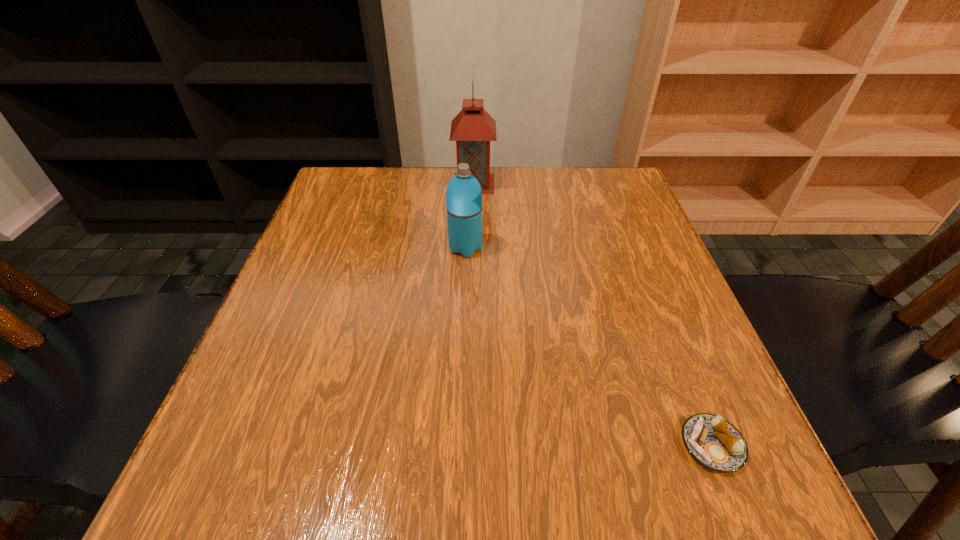
Where is `the tallest object`? the tallest object is located at coordinates (473, 128).

You are a GUI agent. You are given a task and a screenshot of the screen. Output one action in this format:
    pyautogui.click(x=<x>, y=<y>)
    Task: Click on the farthest object
    This screenshot has width=960, height=540.
    Given the screenshot: What is the action you would take?
    pyautogui.click(x=473, y=128)

Where is `the second tallest object`? This screenshot has width=960, height=540. the second tallest object is located at coordinates (463, 195).

Find the location of a particular element. the second farthest object is located at coordinates [463, 195].

The height and width of the screenshot is (540, 960). What are the coordinates of `the rightmost object` in the screenshot? It's located at (714, 442).

Find the location of `the nearest object`. the nearest object is located at coordinates (714, 442).

Find the location of a particular element. The image size is (960, 540). vacant space located 0.290m on the right of the farthest object is located at coordinates (604, 184).

Find the location of a particular element. vacant space located 0.120m on the back of the thermos bottle is located at coordinates (468, 208).

This screenshot has height=540, width=960. In order to click on vacant space located 0.270m on the left of the shortest object in this screenshot , I will do `click(496, 445)`.

Find the location of a particular element. This screenshot has width=960, height=540. object present at the far edge is located at coordinates (473, 128).